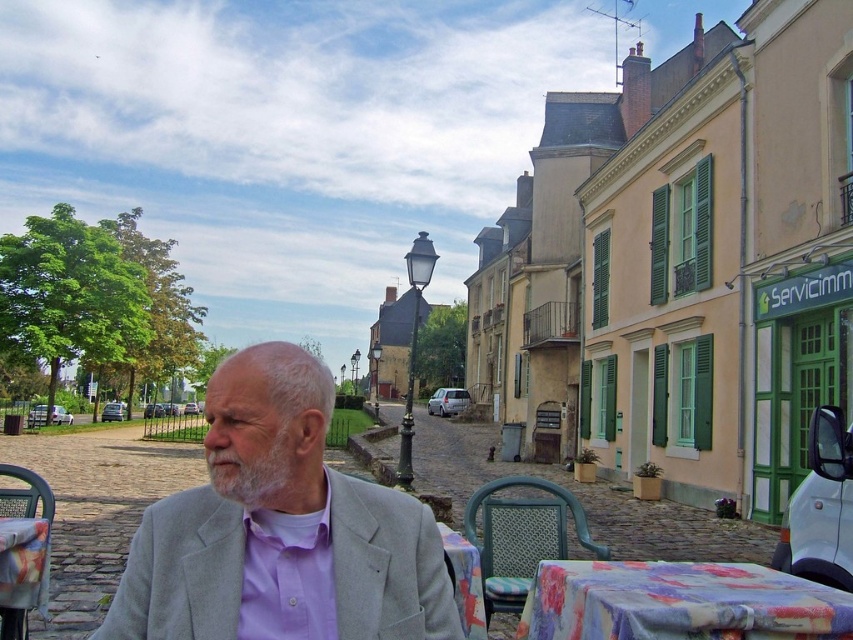
You are standing at the center of the cobblestone street and see the point marked at coordinates (682,262). Which building does this point belong to?

The point marked at coordinates (682,262) belongs to the pastel yellow building with green shutters at center.

You are standing in the middle of the street and see the floral printed fabric at lower right. If you want to reach it, how many steps would you need to take? Assume each step covers 0.75 meters.

The distance between you and the floral printed fabric at lower right is 2.90 meters. Each step covers 0.75 meters, so dividing 2.90 by 0.75 gives approximately 3.87 steps. Since you can only take whole steps, you would need to take 4 steps to reach it.